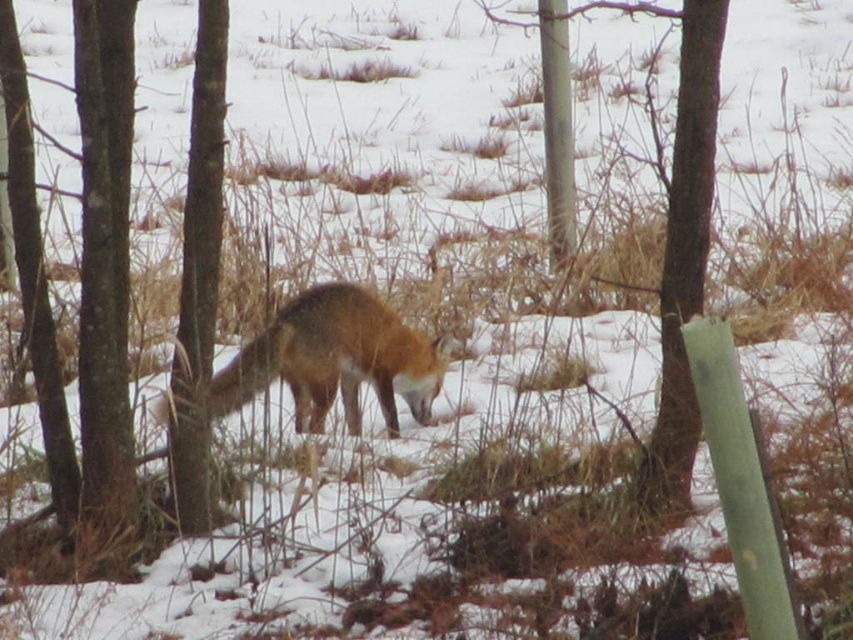
Question: Is fluffy reddish-brown fox at center wider than smooth bark tree at center?

Choices:
 (A) yes
 (B) no

Answer: (A)

Question: Does fluffy reddish-brown fox at center have a smaller size compared to smooth bark tree at center?

Choices:
 (A) no
 (B) yes

Answer: (A)

Question: Which of the following is the closest to the observer?

Choices:
 (A) smooth bark tree at left
 (B) fluffy reddish-brown fox at center
 (C) brown wood tree at center

Answer: (A)

Question: Can you confirm if smooth bark tree at left is positioned to the right of brown wood tree at center?

Choices:
 (A) yes
 (B) no

Answer: (B)

Question: Considering the real-world distances, which object is closest to the smooth bark tree at left?

Choices:
 (A) brown wood tree at center
 (B) fluffy reddish-brown fox at center

Answer: (B)

Question: Which point is closer to the camera?

Choices:
 (A) (102, 280)
 (B) (207, 173)

Answer: (A)